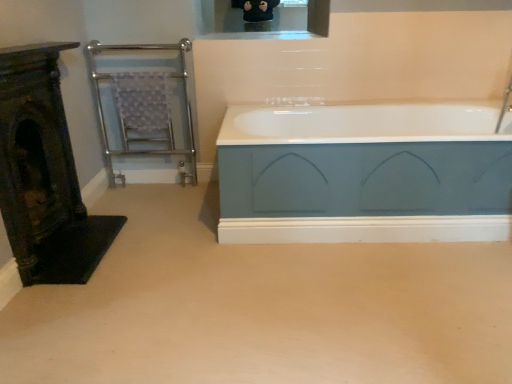
I want to click on blank area beneath dark green ornate fireplace at left (from a real-world perspective), so click(x=59, y=237).